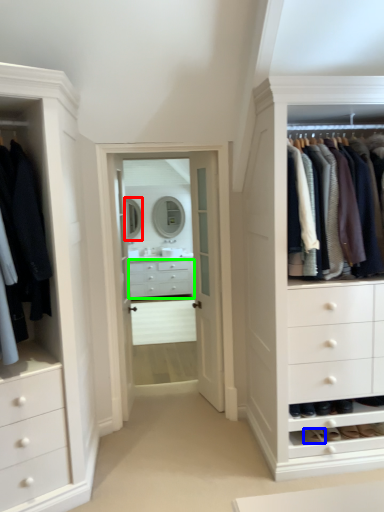
Question: Based on their relative distances, which object is farther from mirror (highlighted by a red box)? Choose from shoe (highlighted by a blue box) and drawer (highlighted by a green box).

Choices:
 (A) shoe
 (B) drawer

Answer: (A)